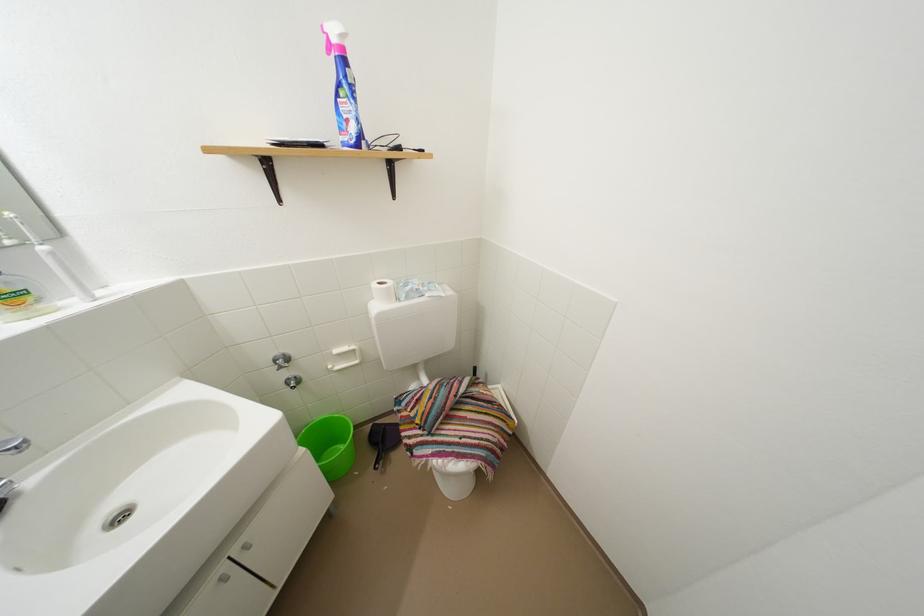
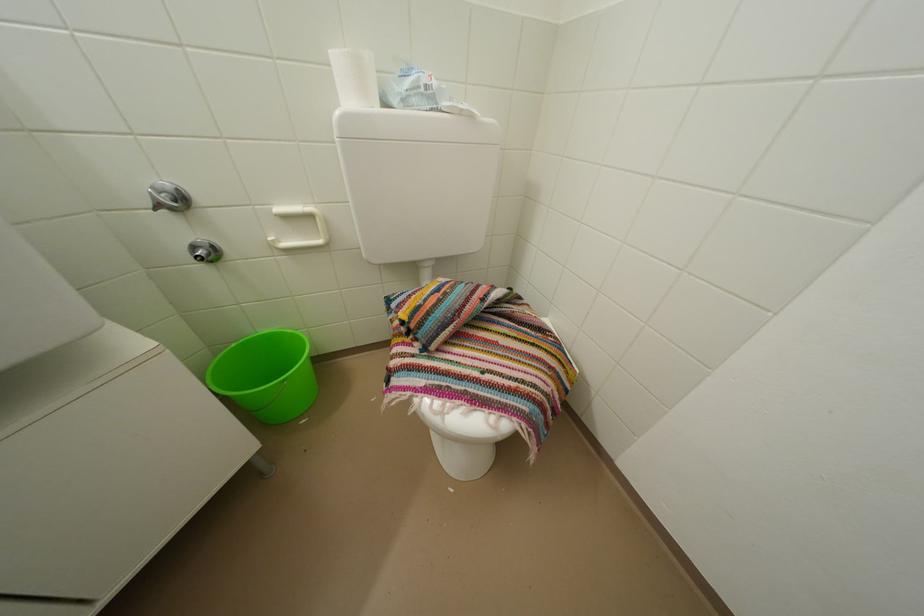
In the second image, find the point that corresponds to point (388, 289) in the first image.

(359, 55)